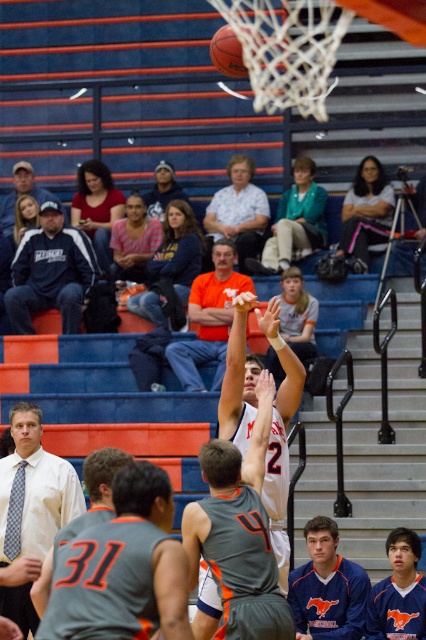
Question: Is gray jersey at center bigger than white matte basketball player at center?

Choices:
 (A) yes
 (B) no

Answer: (B)

Question: Can you confirm if green fabric jacket at center is bigger than dark blue baseball cap at upper left?

Choices:
 (A) no
 (B) yes

Answer: (B)

Question: Estimate the real-world distances between objects in this image. Which object is closer to the blue jersey at center?

Choices:
 (A) dark blue baseball cap at upper left
 (B) rubber basketball at center
 (C) white matte basketball player at center
 (D) dark blue jacket at left

Answer: (C)

Question: Which object appears farthest from the camera in this image?

Choices:
 (A) white matte basketball player at center
 (B) orange jersey at center

Answer: (B)

Question: Is white shirt at center smaller than green fabric jacket at center?

Choices:
 (A) no
 (B) yes

Answer: (B)

Question: Based on their relative distances, which object is farther from the green fabric jacket at center?

Choices:
 (A) orange jersey at center
 (B) blue jersey at center
 (C) gray jersey at center
 (D) rubber basketball at center

Answer: (C)